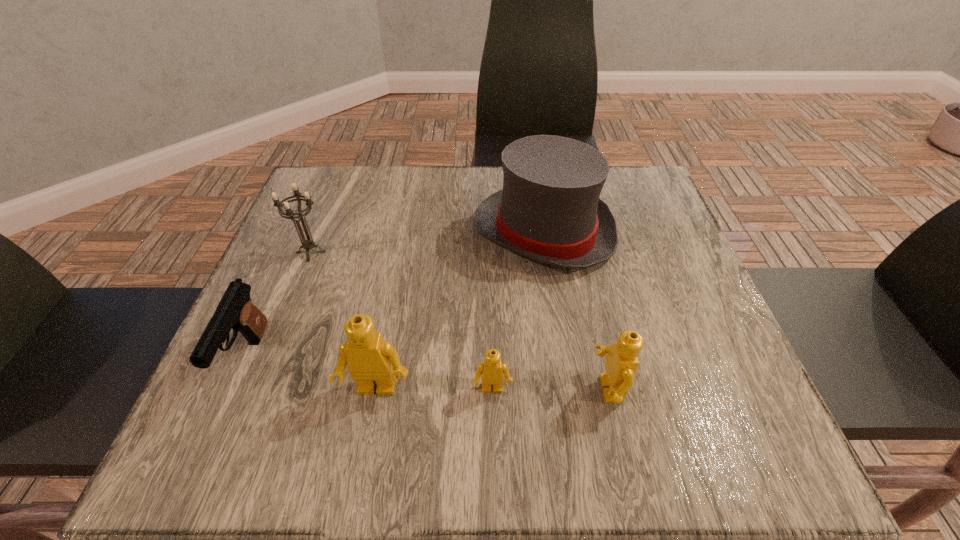
Locate an element on the screen. This screenshot has height=540, width=960. free space that is in between the pistol and the leftmost Lego is located at coordinates (312, 374).

At what (x,y) coordinates should I click in order to perform the action: click on free space between the dress hat and the candle holder. Please return your answer as a coordinate pair (x, y). This screenshot has width=960, height=540. Looking at the image, I should click on (427, 242).

This screenshot has width=960, height=540. I want to click on vacant region between the shortest Lego and the fourth object from right to left, so click(434, 389).

Locate an element on the screen. Image resolution: width=960 pixels, height=540 pixels. unoccupied area between the second shortest Lego and the dress hat is located at coordinates (576, 310).

Where is `vacant space that is in between the rightmost Lego and the third object from left to right`? Image resolution: width=960 pixels, height=540 pixels. vacant space that is in between the rightmost Lego and the third object from left to right is located at coordinates (492, 389).

Where is `blank region between the second shortest Lego and the fourth object from right to left`? The image size is (960, 540). blank region between the second shortest Lego and the fourth object from right to left is located at coordinates (492, 389).

The width and height of the screenshot is (960, 540). I want to click on object that stands as the fifth closest to the second tallest Lego, so click(235, 310).

Locate which object is the fourth closest to the fourth object from right to left. Please provide its 2D coordinates. Your answer should be formatted as a tuple, i.e. [(x, y)], where the tuple contains the x and y coordinates of a point satisfying the conditions above.

[(308, 244)]

The width and height of the screenshot is (960, 540). I want to click on Lego that is the second closest one to the dress hat, so click(x=492, y=370).

I want to click on Lego that is the second closest to the pistol, so click(492, 370).